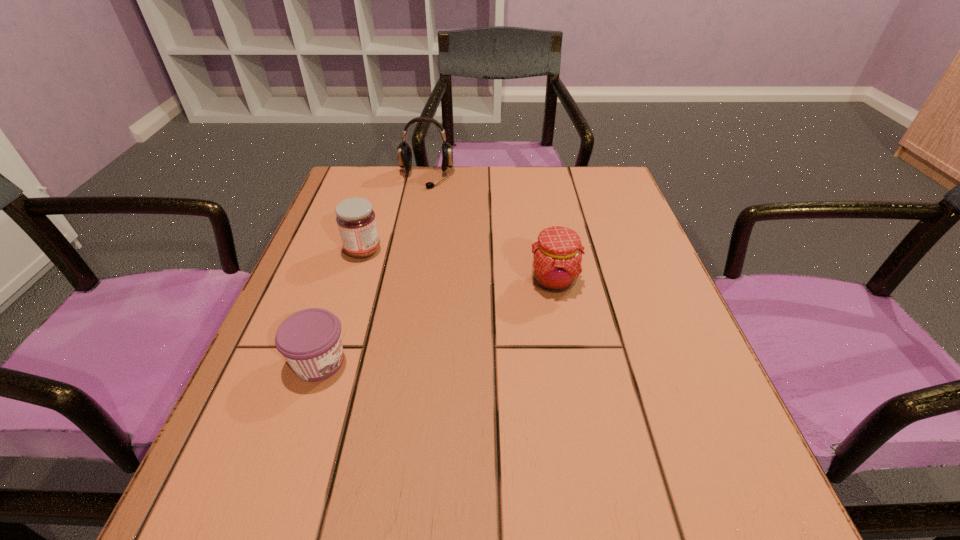
You are a GUI agent. You are given a task and a screenshot of the screen. Output one action in this format:
    pyautogui.click(x=<x>, y=<y>)
    Task: Click on the free space at the far right corner of the desktop
    This screenshot has height=540, width=960.
    Given the screenshot: What is the action you would take?
    pyautogui.click(x=624, y=212)

The width and height of the screenshot is (960, 540). Find the location of `empty space that is in between the farthest object and the third farthest object`. empty space that is in between the farthest object and the third farthest object is located at coordinates (490, 230).

The image size is (960, 540). What are the coordinates of `free spot between the shortest jam and the tallest object` in the screenshot? It's located at (372, 269).

Identify the location of vacant space in between the tallest object and the shortest jam. (372, 269).

Find the location of a particular element. empty space that is in between the tallest object and the farthest jam is located at coordinates [395, 214].

Locate an element on the screen. The width and height of the screenshot is (960, 540). unoccupied position between the shortest object and the headset is located at coordinates (372, 269).

Locate an element on the screen. This screenshot has height=540, width=960. unoccupied area between the second nearest jam and the farthest jam is located at coordinates (458, 266).

The width and height of the screenshot is (960, 540). I want to click on free space that is in between the second farthest jam and the farthest object, so click(490, 230).

Identify the location of free spot between the nearest object and the third nearest object. (341, 306).

Find the location of a particular element. The height and width of the screenshot is (540, 960). free space that is in between the farthest jam and the shortest object is located at coordinates (341, 306).